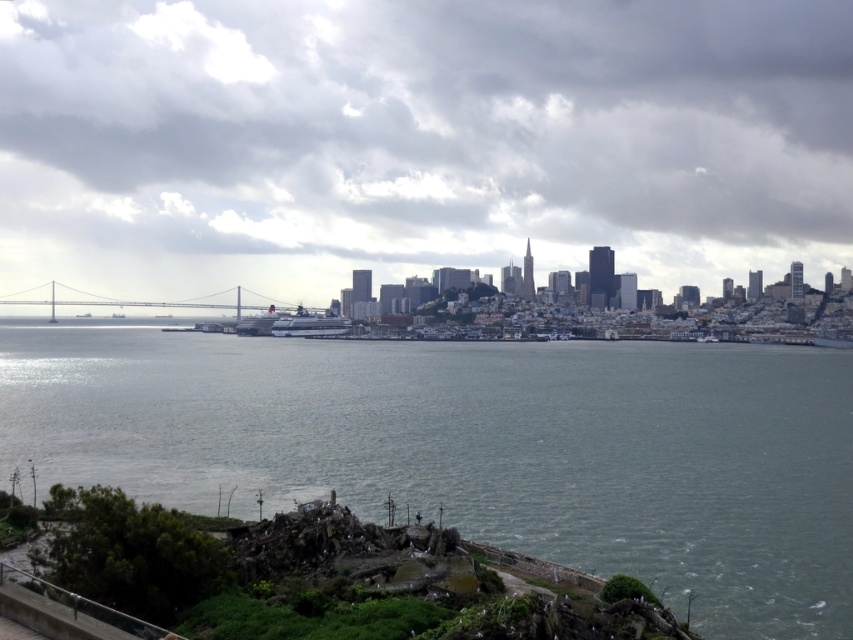
You are a tourist standing on the pathway overlooking the bay. You see the gray water at center and the metallic gray bridge at center. Which object is located below the other?

The gray water at center is positioned under the metallic gray bridge at center, so the gray water at center is below the metallic gray bridge at center.

You are a photographer planning to take a picture of the cloudy sky at upper center and the gray water at center. Based on their positions in the scene, which one would appear closer to the camera in the photo?

The cloudy sky at upper center would appear closer to the camera because it is in front of the gray water at center.